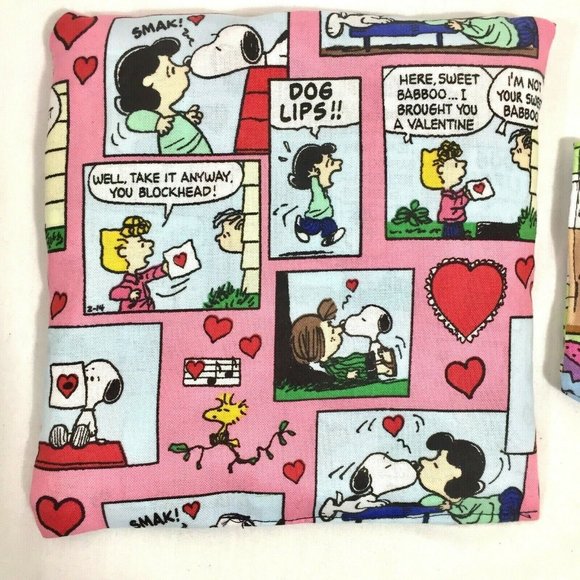
Image resolution: width=580 pixels, height=580 pixels. I want to click on white tablecloth, so 285,547.